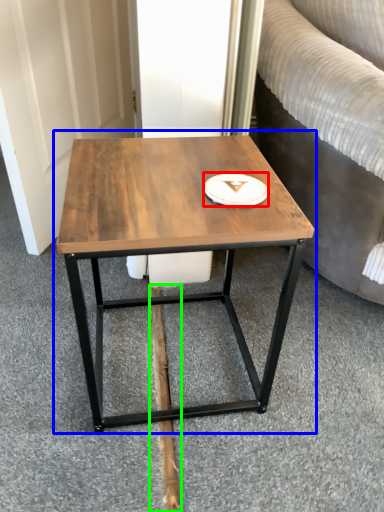
Question: Considering the real-world distances, which object is farthest from platter (highlighted by a red box)? coffee table (highlighted by a blue box) or plank (highlighted by a green box)?

Choices:
 (A) coffee table
 (B) plank

Answer: (B)